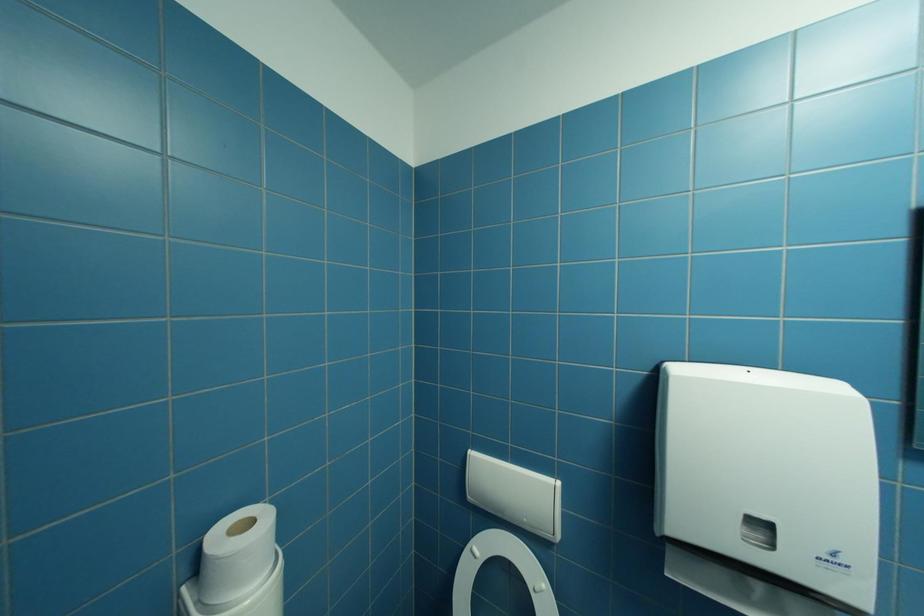
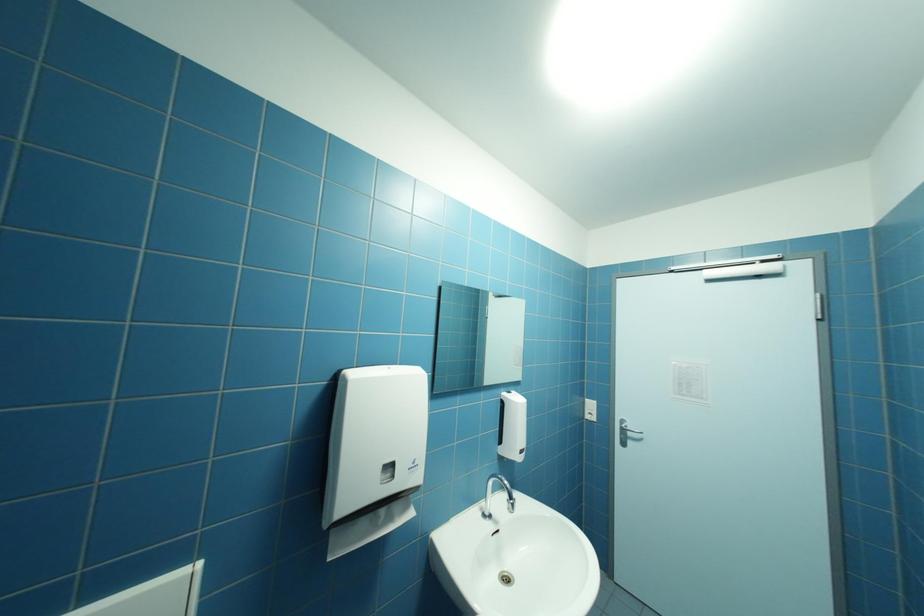
Question: The camera is either moving clockwise (left) or counter-clockwise (right) around the object. The first image is from the beginning of the video and the second image is from the end. Is the camera moving left or right when shooting the video?

Choices:
 (A) Left
 (B) Right

Answer: (A)